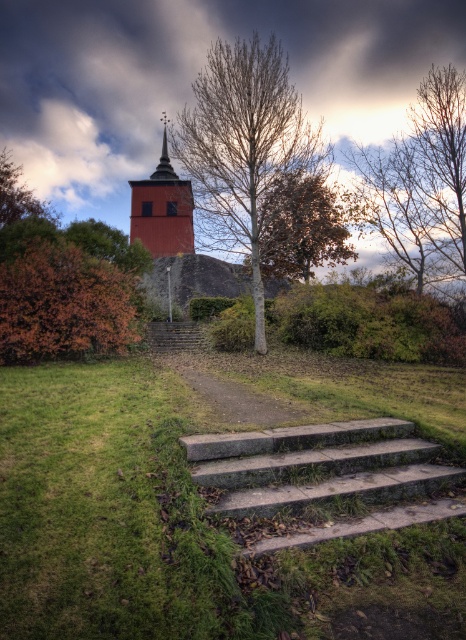
Locate an element on the screen. bare wood tree at center is located at coordinates (246, 154).

Can you confirm if bare wood tree at center is bigger than concrete stairs at center?

Correct, bare wood tree at center is larger in size than concrete stairs at center.

Which is in front, point (271, 144) or point (158, 326)?

Positioned in front is point (271, 144).

You are a GUI agent. You are given a task and a screenshot of the screen. Output one action in this format:
    pyautogui.click(x=<x>, y=<y>)
    Task: Click on the bare wood tree at center
    This screenshot has width=466, height=640.
    Given the screenshot: What is the action you would take?
    pyautogui.click(x=246, y=154)

Does green grass at lower left have a smaller size compared to smooth red wooden tower at upper center?

Indeed, green grass at lower left has a smaller size compared to smooth red wooden tower at upper center.

Can you confirm if green grass at lower left is positioned above smooth red wooden tower at upper center?

Actually, green grass at lower left is below smooth red wooden tower at upper center.

Is point (55, 362) in front of point (191, 248)?

Yes, it is in front of point (191, 248).

Find the location of a particular element. green grass at lower left is located at coordinates (148, 518).

Can you confirm if bare branches at upper center is thinner than autumn leaves at left?

No, bare branches at upper center is not thinner than autumn leaves at left.

Between bare branches at upper center and autumn leaves at left, which one appears on the left side from the viewer's perspective?

autumn leaves at left is more to the left.

Is point (391, 240) closer to viewer compared to point (38, 298)?

No, (391, 240) is behind (38, 298).

At what (x,y) coordinates should I click in order to perform the action: click on bare branches at upper center. Please return your answer as a coordinate pair (x, y). This screenshot has width=466, height=640. Looking at the image, I should click on (419, 182).